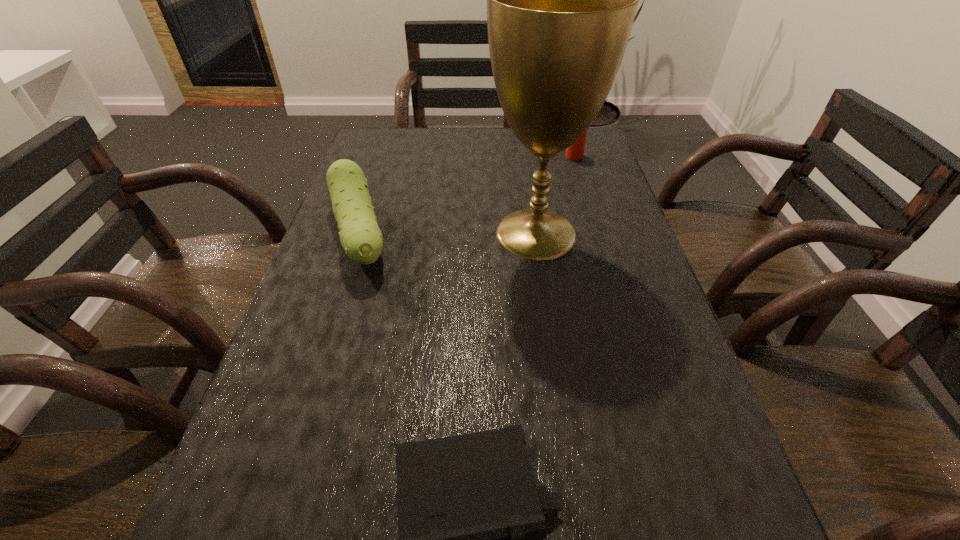
The image size is (960, 540). In order to click on trophy cup located at the right edge in this screenshot , I will do `click(561, 0)`.

Identify the location of Tabasco sauce at the right edge. (575, 152).

This screenshot has height=540, width=960. I want to click on object that is at the far right corner, so click(x=575, y=152).

The width and height of the screenshot is (960, 540). Find the location of `free space at the far edge`. free space at the far edge is located at coordinates (492, 142).

You are a GUI agent. You are given a task and a screenshot of the screen. Output one action in this format:
    pyautogui.click(x=<x>, y=<y>)
    Task: Click on the free location at the left edge
    This screenshot has height=540, width=960.
    Given the screenshot: What is the action you would take?
    pyautogui.click(x=334, y=294)

Locate an element on the screen. The image size is (960, 540). vacant space at the far left corner of the desktop is located at coordinates (361, 163).

The image size is (960, 540). Identify the location of vacant space at the far right corner of the desktop. (557, 156).

Image resolution: width=960 pixels, height=540 pixels. What are the coordinates of `vacant space that is in between the farthest object and the tallest object` in the screenshot? It's located at (555, 195).

Image resolution: width=960 pixels, height=540 pixels. Identify the location of vacant area between the third tallest object and the rightmost object. (467, 196).

The height and width of the screenshot is (540, 960). What are the coordinates of `vacant space in between the second shortest object and the trophy cup` in the screenshot? It's located at (447, 234).